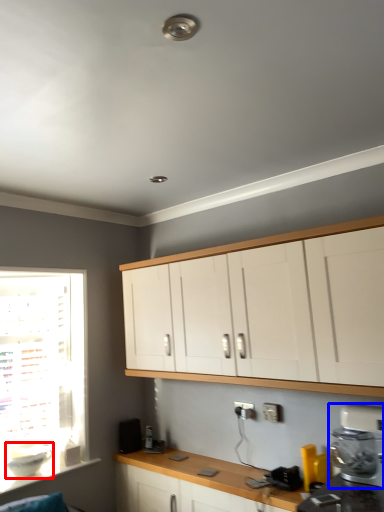
Question: Which point is closer to the camera, appliance (highlighted by a red box) or kitchen appliance (highlighted by a blue box)?

Choices:
 (A) appliance
 (B) kitchen appliance

Answer: (B)